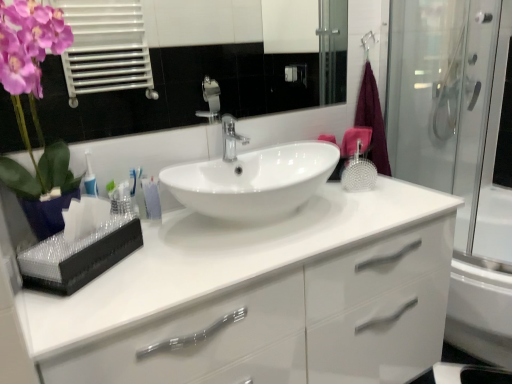
You are a GUI agent. You are given a task and a screenshot of the screen. Output one action in this format:
    pyautogui.click(x=<x>, y=<y>)
    Task: Click on the free area below white glossy sink at center (from a real-world perspective)
    The height and width of the screenshot is (384, 512).
    Given the screenshot: What is the action you would take?
    pyautogui.click(x=250, y=224)